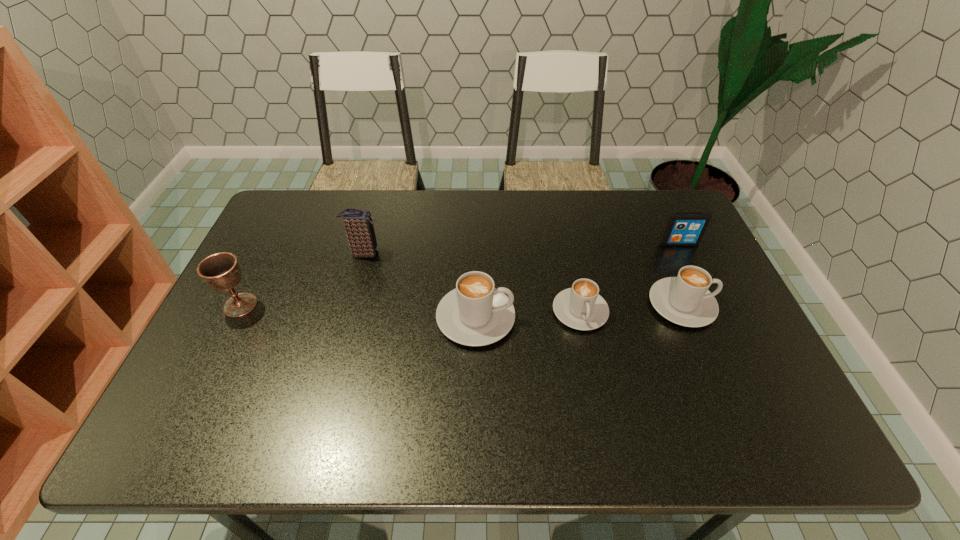
Identify which cappuccino is the second closest to the fourth object from right to left. Please provide its 2D coordinates. Your answer should be formatted as a tuple, i.e. [(x, y)], where the tuple contains the x and y coordinates of a point satisfying the conditions above.

[(685, 300)]

The height and width of the screenshot is (540, 960). I want to click on cappuccino that can be found as the second closest to the shortest object, so click(x=685, y=300).

Image resolution: width=960 pixels, height=540 pixels. Find the location of `vacant position in the image that satisfies the following two spatial constraints: 1. to the right of the shortest object; 2. to the right of the leftmost cappuccino`. vacant position in the image that satisfies the following two spatial constraints: 1. to the right of the shortest object; 2. to the right of the leftmost cappuccino is located at coordinates (582, 318).

Find the location of a particular element. Image resolution: width=960 pixels, height=540 pixels. free location that satisfies the following two spatial constraints: 1. on the front screen of the farthest object; 2. to the right of the leftmost cappuccino is located at coordinates (713, 318).

This screenshot has height=540, width=960. Find the location of `free spot that satisfies the following two spatial constraints: 1. to the right of the second cappuccino from left to right; 2. to the right of the leftmost cappuccino`. free spot that satisfies the following two spatial constraints: 1. to the right of the second cappuccino from left to right; 2. to the right of the leftmost cappuccino is located at coordinates (582, 318).